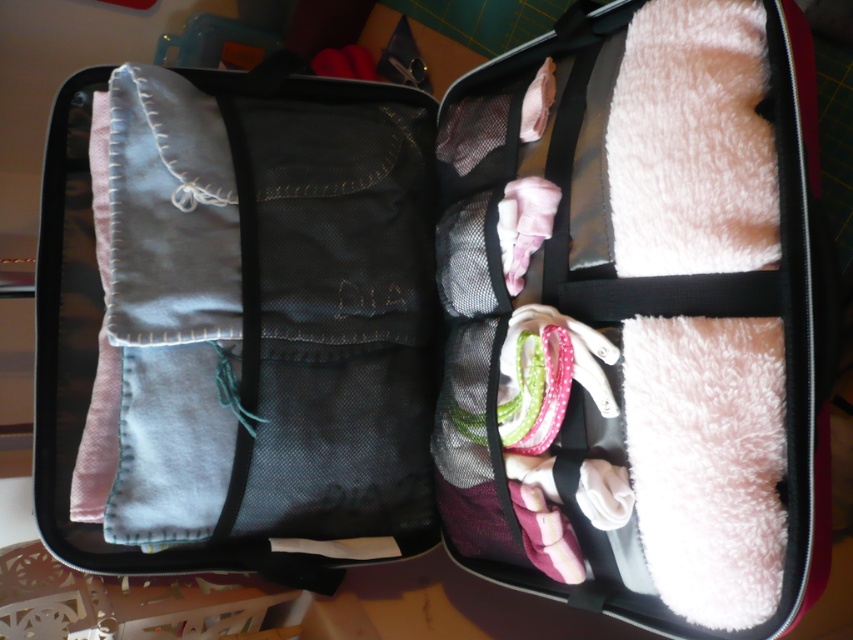
You are packing for a trip and need to determine if the white fluffy towel at upper right can be folded and placed into the space currently occupied by the denim fabric pants at left. Based on their sizes, is this feasible?

The white fluffy towel at upper right has a larger size compared to denim fabric pants at left. Therefore, it may not fit into the space currently occupied by the denim fabric pants at left unless it is folded or compressed.

You are packing for a trip and need to access the denim fabric pants at left inside the suitcase. However, the white fluffy towel at upper right is blocking your way. Can you remove the towel to get to the pants?

The white fluffy towel at upper right is in front of the denim fabric pants at left, so you can remove the white fluffy towel at upper right first to access the denim fabric pants at left.

You are packing for a trip and need to know if the white fluffy towel at upper right will fit in your backpack which has a maximum depth of 30 inches. Based on the image, can you determine if it will fit?

The white fluffy towel at upper right is 31.34 inches from the camera, which is slightly longer than the backpacks 30 inch depth. It may not fit unless compressed or folded.